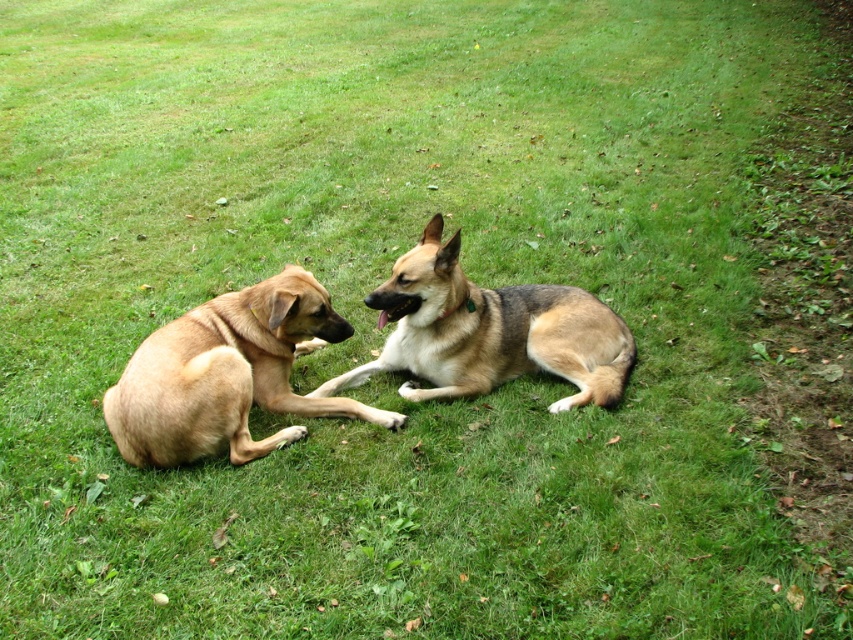
You are a dog owner who wants to buy a new collar for both your dogs. The golden fur dog at left and the brown fur dog at center. Since you want the collars to be proportional to their sizes, which dog requires a larger collar?

The brown fur dog at center requires a larger collar since it is bigger than the golden fur dog at left.

Consider the image. You are taking a photo of two dogs lying on a grassy area. The dogs are positioned at point [166,433] and point [554,336]. Which dog is closer to the camera?

The dog at point [166,433] is closer to the camera than the dog at point [554,336].

You are a dog trainer assessing the space between two dogs in the image. The golden fur dog at left and the brown fur dog at center are both lying down. If you need to place a 1.2 meter wide exercise mat between them, will there be enough space?

The golden fur dog at left has a lesser width compared to brown fur dog at center. However, the exact distance between them isn not specified in the provided information. Without knowing the actual spacing between the two dogs, it is impossible to determine if the 1.2 meter wide exercise mat will fit.